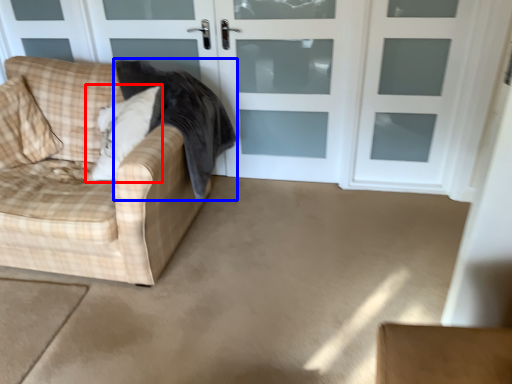
Question: Among these objects, which one is nearest to the camera, pillow (highlighted by a red box) or blanket (highlighted by a blue box)?

Choices:
 (A) pillow
 (B) blanket

Answer: (B)